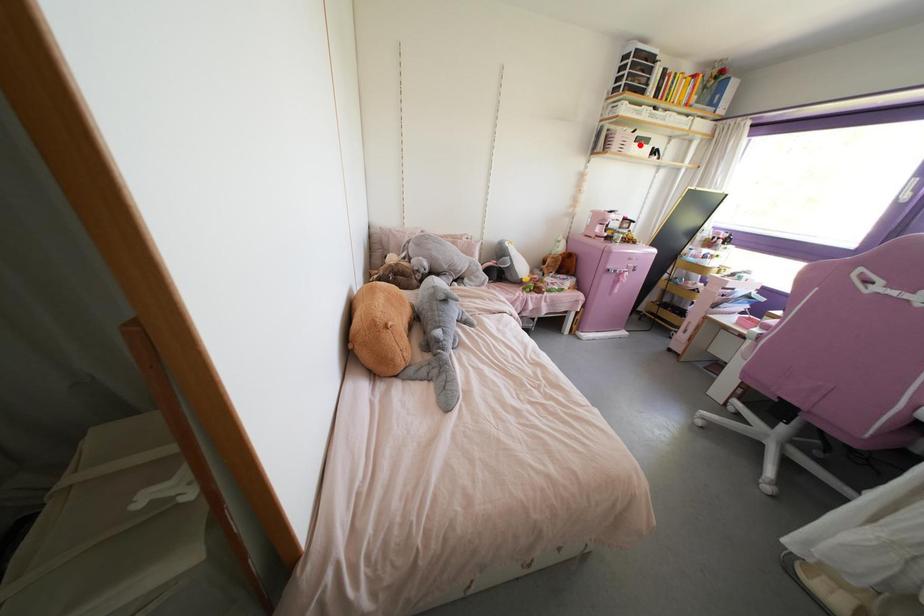
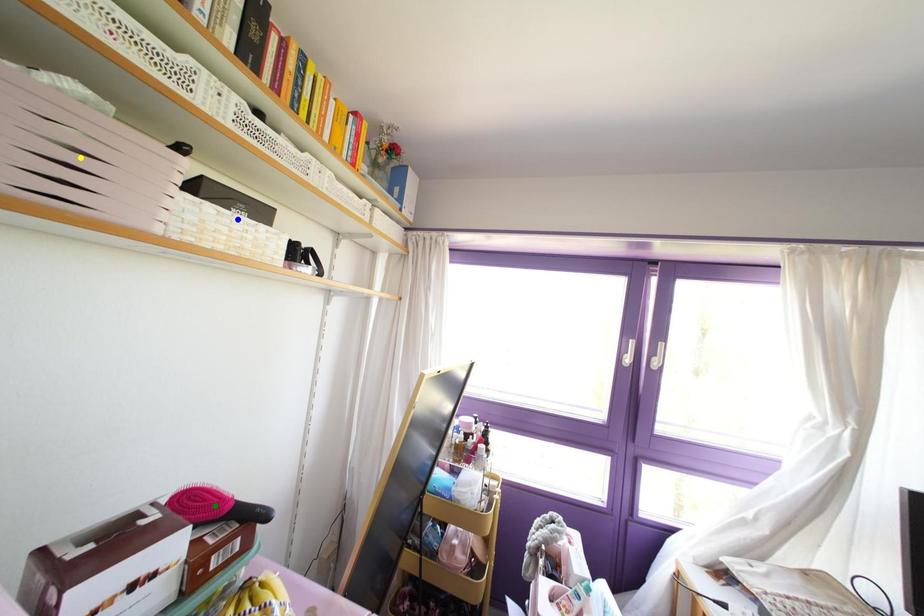
Question: I am providing you with two images of the same scene from different viewpoints. A red point is marked on the first image. You are given multiple points on the second image. In image 2, which mark is for the same physical point as the one in image 1?

Choices:
 (A) blue point
 (B) green point
 (C) yellow point

Answer: (A)